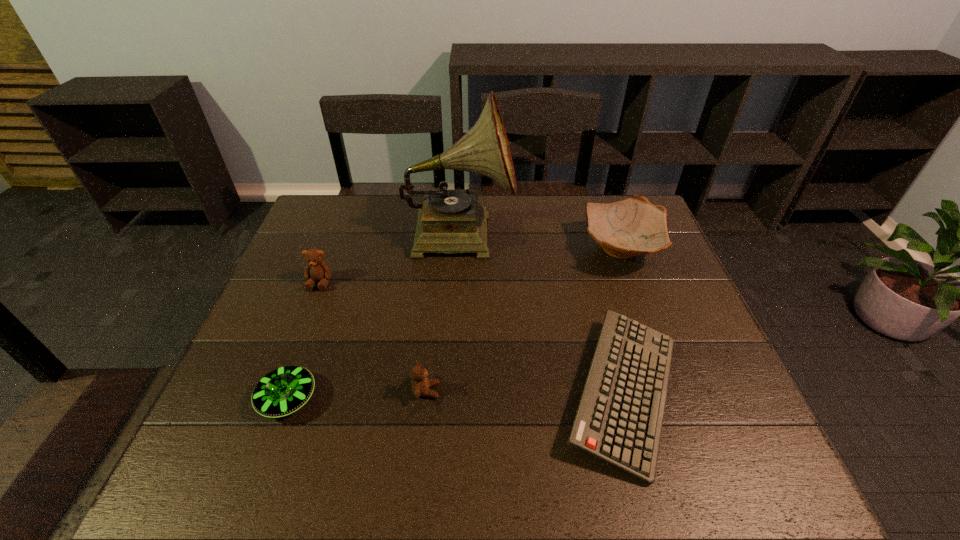
The width and height of the screenshot is (960, 540). Find the location of `object present at the near right corner`. object present at the near right corner is located at coordinates (619, 419).

The image size is (960, 540). Identify the location of free point at the far edge. (579, 208).

Identify the location of vacant region at the near edge. [282, 460].

Locate an element on the screen. This screenshot has height=540, width=960. vacant space at the left edge of the desktop is located at coordinates (331, 259).

Locate an element on the screen. The image size is (960, 540). vacant area at the right edge is located at coordinates (681, 411).

You are a GUI agent. You are given a task and a screenshot of the screen. Output one action in this format:
    pyautogui.click(x=<x>, y=<y>)
    Task: Click on the free spot at the far left corner of the desktop
    This screenshot has width=960, height=540.
    Given the screenshot: What is the action you would take?
    pyautogui.click(x=300, y=233)

Where is `free space between the pottery and the left teddy bear`? The width and height of the screenshot is (960, 540). free space between the pottery and the left teddy bear is located at coordinates (471, 266).

In order to click on unoccupied area between the right teddy bear and the saucer in this screenshot , I will do `click(357, 395)`.

The height and width of the screenshot is (540, 960). What are the coordinates of `vacant area that lies between the computer keyboard and the saucer` in the screenshot? It's located at (456, 395).

The image size is (960, 540). Find the location of `free point between the pottery and the right teddy bear`. free point between the pottery and the right teddy bear is located at coordinates (524, 320).